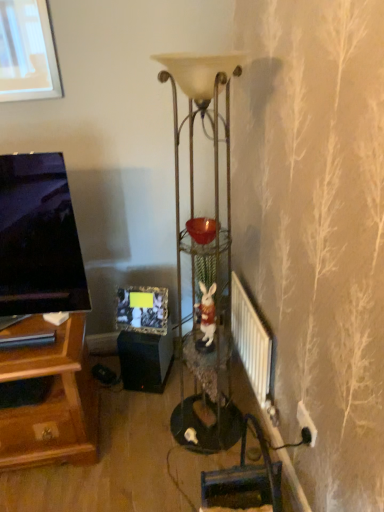
Question: Does metallic gold floor lamp at center come behind matte black picture frame at center?

Choices:
 (A) no
 (B) yes

Answer: (A)

Question: Is matte black picture frame at center a part of metallic gold floor lamp at center?

Choices:
 (A) yes
 (B) no

Answer: (B)

Question: From the image's perspective, is metallic gold floor lamp at center located beneath matte black picture frame at center?

Choices:
 (A) no
 (B) yes

Answer: (A)

Question: Is metallic gold floor lamp at center at the left side of matte black picture frame at center?

Choices:
 (A) no
 (B) yes

Answer: (A)

Question: Are metallic gold floor lamp at center and matte black picture frame at center far apart?

Choices:
 (A) no
 (B) yes

Answer: (A)

Question: Is metallic gold floor lamp at center closer to the viewer compared to matte black picture frame at center?

Choices:
 (A) no
 (B) yes

Answer: (B)

Question: Can you confirm if black matte speaker at lower center is wider than white metallic radiator at lower right?

Choices:
 (A) yes
 (B) no

Answer: (A)

Question: Can you confirm if black matte speaker at lower center is smaller than white metallic radiator at lower right?

Choices:
 (A) yes
 (B) no

Answer: (B)

Question: From a real-world perspective, is black matte speaker at lower center over white metallic radiator at lower right?

Choices:
 (A) yes
 (B) no

Answer: (B)

Question: Is black matte speaker at lower center aimed at white metallic radiator at lower right?

Choices:
 (A) yes
 (B) no

Answer: (B)

Question: Is black matte speaker at lower center to the left of white metallic radiator at lower right from the viewer's perspective?

Choices:
 (A) no
 (B) yes

Answer: (B)

Question: From the image's perspective, is black matte speaker at lower center beneath white metallic radiator at lower right?

Choices:
 (A) no
 (B) yes

Answer: (B)

Question: Is white ceramic rabbit at center oriented away from metallic gold floor lamp at center?

Choices:
 (A) no
 (B) yes

Answer: (B)